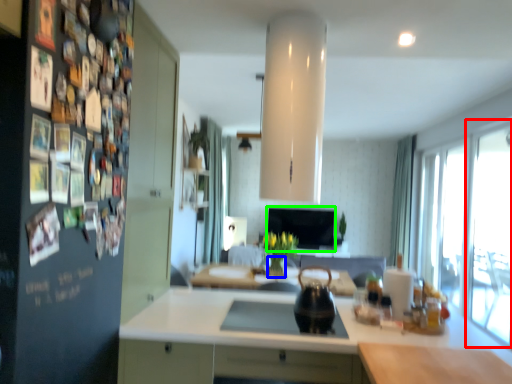
Question: Based on their relative distances, which object is nearer to glass door (highlighted by a red box)? Choose from vase (highlighted by a blue box) and window screen (highlighted by a green box).

Choices:
 (A) vase
 (B) window screen

Answer: (A)